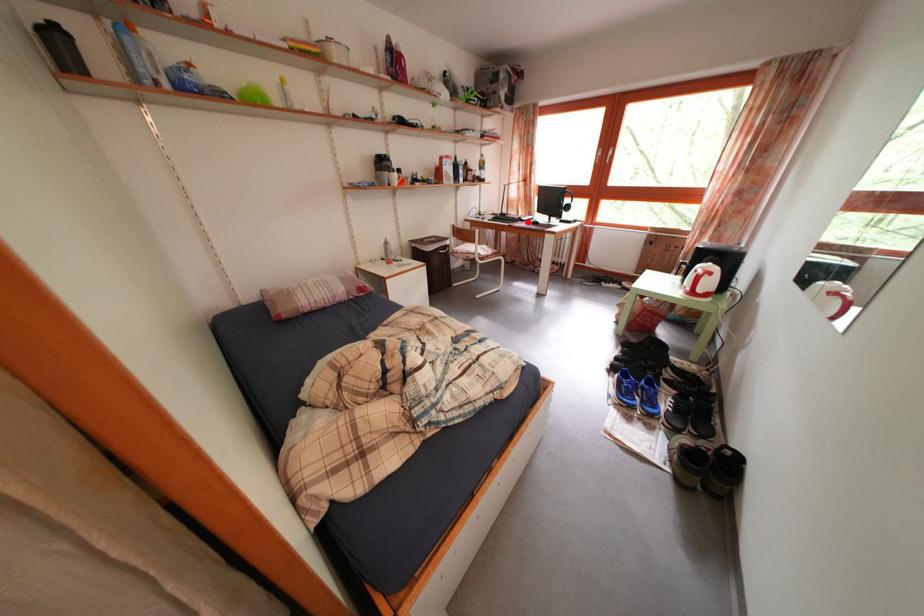
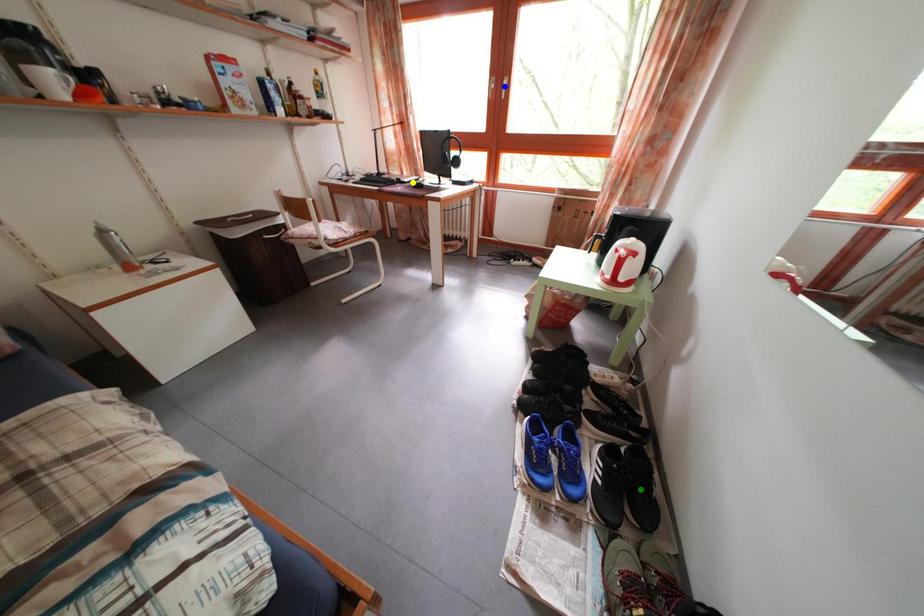
Question: I am providing you with two images of the same scene from different viewpoints. A red point is marked on the first image. You are given multiple points on the second image. In image 2, which mark is for the same physical point as the one in image 1?

Choices:
 (A) yellow point
 (B) blue point
 (C) green point

Answer: (A)